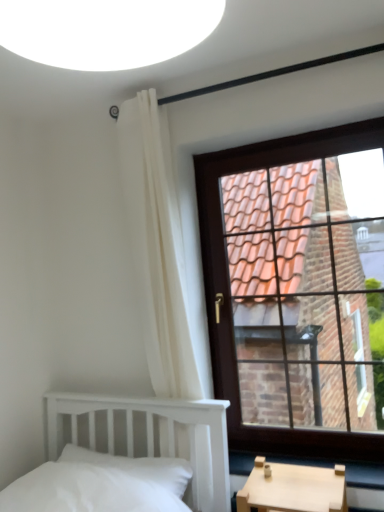
Question: From the image's perspective, is white soft pillow at lower left above white fabric curtain at upper left?

Choices:
 (A) yes
 (B) no

Answer: (B)

Question: Is white soft pillow at lower left at the left side of white fabric curtain at upper left?

Choices:
 (A) yes
 (B) no

Answer: (A)

Question: Considering the relative positions of white soft pillow at lower left and white fabric curtain at upper left in the image provided, is white soft pillow at lower left to the right of white fabric curtain at upper left from the viewer's perspective?

Choices:
 (A) yes
 (B) no

Answer: (B)

Question: Is white soft pillow at lower left not within white fabric curtain at upper left?

Choices:
 (A) yes
 (B) no

Answer: (A)

Question: Is white soft pillow at lower left oriented away from white fabric curtain at upper left?

Choices:
 (A) no
 (B) yes

Answer: (A)

Question: From the image's perspective, would you say white soft pillow at lower left is shown under white fabric curtain at upper left?

Choices:
 (A) yes
 (B) no

Answer: (A)

Question: Is white fabric curtain at upper left positioned before brown wooden window at upper right?

Choices:
 (A) no
 (B) yes

Answer: (B)

Question: Is white fabric curtain at upper left to the left of brown wooden window at upper right from the viewer's perspective?

Choices:
 (A) no
 (B) yes

Answer: (B)

Question: Considering the relative sizes of white fabric curtain at upper left and brown wooden window at upper right in the image provided, is white fabric curtain at upper left bigger than brown wooden window at upper right?

Choices:
 (A) yes
 (B) no

Answer: (B)

Question: Does white fabric curtain at upper left have a lesser height compared to brown wooden window at upper right?

Choices:
 (A) no
 (B) yes

Answer: (A)

Question: From the image's perspective, would you say white fabric curtain at upper left is shown under brown wooden window at upper right?

Choices:
 (A) no
 (B) yes

Answer: (B)

Question: Considering the relative sizes of white fabric curtain at upper left and brown wooden window at upper right in the image provided, is white fabric curtain at upper left smaller than brown wooden window at upper right?

Choices:
 (A) no
 (B) yes

Answer: (B)

Question: Is brown wooden window at upper right shorter than white fabric curtain at upper left?

Choices:
 (A) yes
 (B) no

Answer: (A)